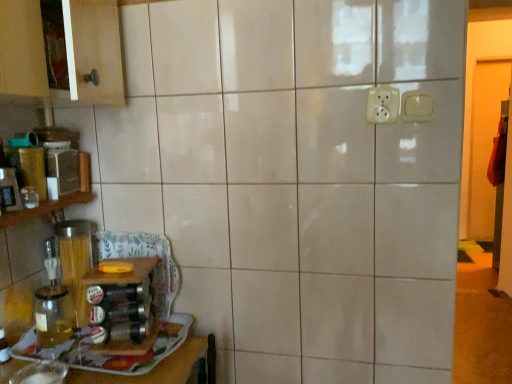
Locate an element on the screen. free space to the right of transparent glass jar at left is located at coordinates (90, 344).